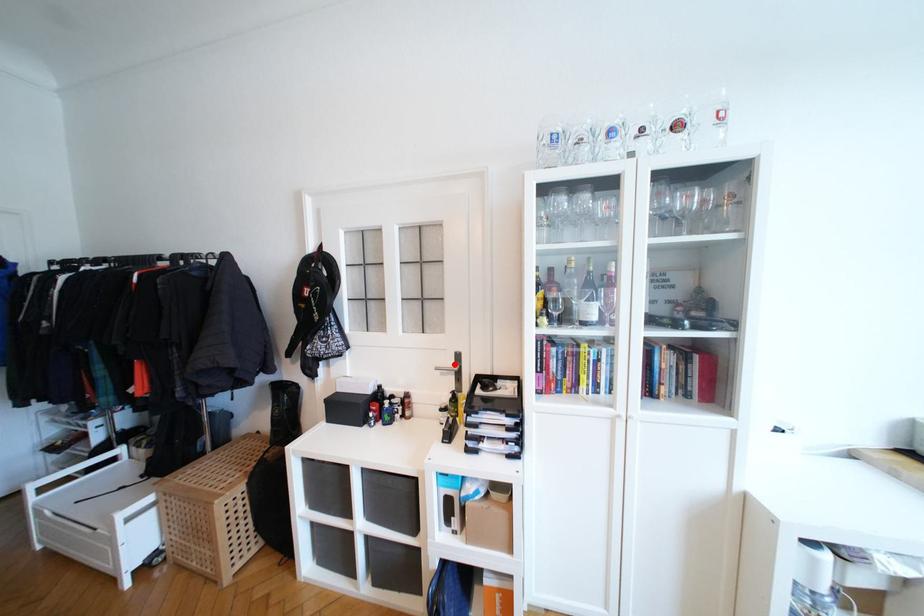
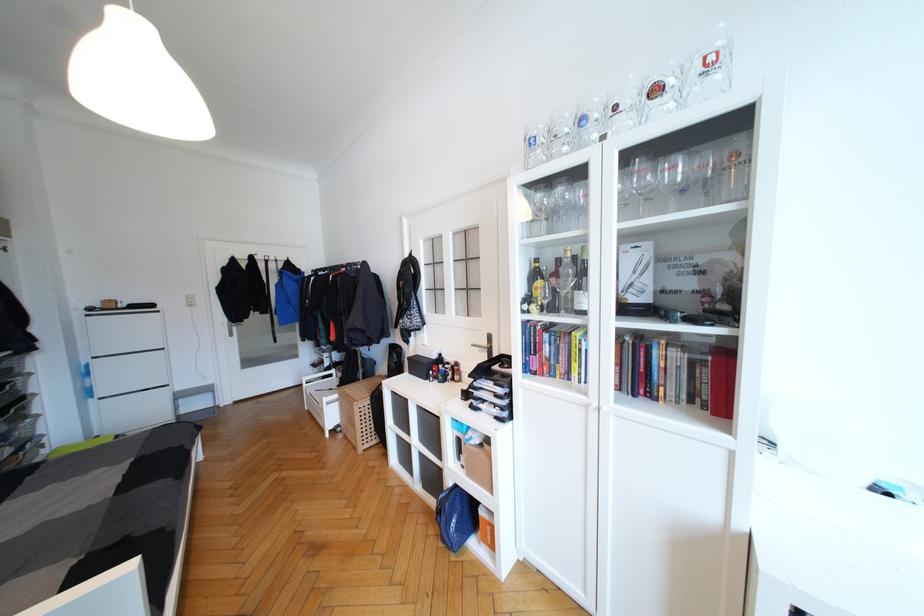
In the second image, find the point that corresponds to the highlighted location in the first image.

(488, 344)